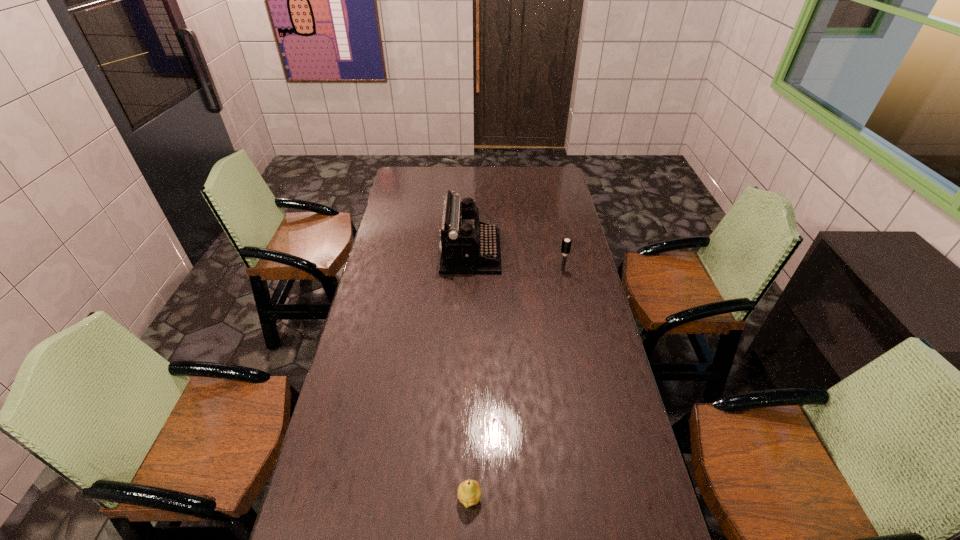
I want to click on vacant space in between the rightmost object and the typewriter, so click(516, 261).

Find the location of a particular element. free space between the nearest object and the rightmost object is located at coordinates (516, 384).

You are a GUI agent. You are given a task and a screenshot of the screen. Output one action in this format:
    pyautogui.click(x=<x>, y=<y>)
    Task: Click on the empty space that is in between the second shortest object and the pear
    The width and height of the screenshot is (960, 540).
    Given the screenshot: What is the action you would take?
    pyautogui.click(x=516, y=384)

Locate which object is the second closest to the rightmost object. Please provide its 2D coordinates. Your answer should be formatted as a tuple, i.e. [(x, y)], where the tuple contains the x and y coordinates of a point satisfying the conditions above.

[(469, 493)]

Where is `object that stands as the second closest to the rightmost object`? The image size is (960, 540). object that stands as the second closest to the rightmost object is located at coordinates (469, 493).

This screenshot has height=540, width=960. Identify the location of free point that satisfies the following two spatial constraints: 1. on the typing side of the tallest object; 2. on the back side of the rightmost object. (470, 271).

The width and height of the screenshot is (960, 540). I want to click on vacant space that satisfies the following two spatial constraints: 1. on the back side of the pear; 2. on the typing side of the tallest object, so click(x=474, y=252).

Image resolution: width=960 pixels, height=540 pixels. What are the coordinates of `free location that satisfies the following two spatial constraints: 1. on the typing side of the typewriter; 2. on the back side of the nearest object` in the screenshot? It's located at (465, 498).

The height and width of the screenshot is (540, 960). I want to click on vacant space that satisfies the following two spatial constraints: 1. on the back side of the shortest object; 2. on the left side of the hairbrush, so click(x=473, y=271).

Where is `free space that satisfies the following two spatial constraints: 1. on the back side of the pear; 2. on the typing side of the tallest object`? free space that satisfies the following two spatial constraints: 1. on the back side of the pear; 2. on the typing side of the tallest object is located at coordinates (474, 252).